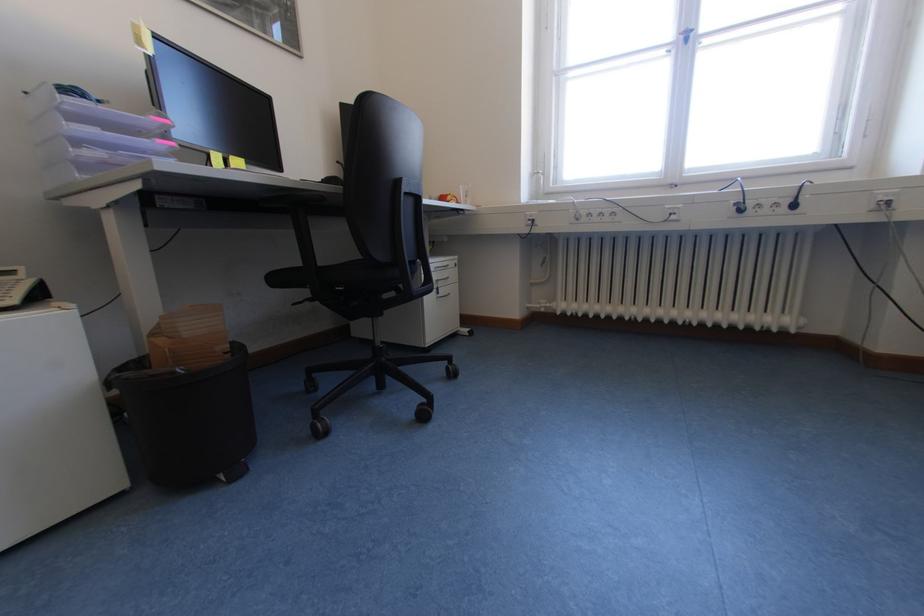
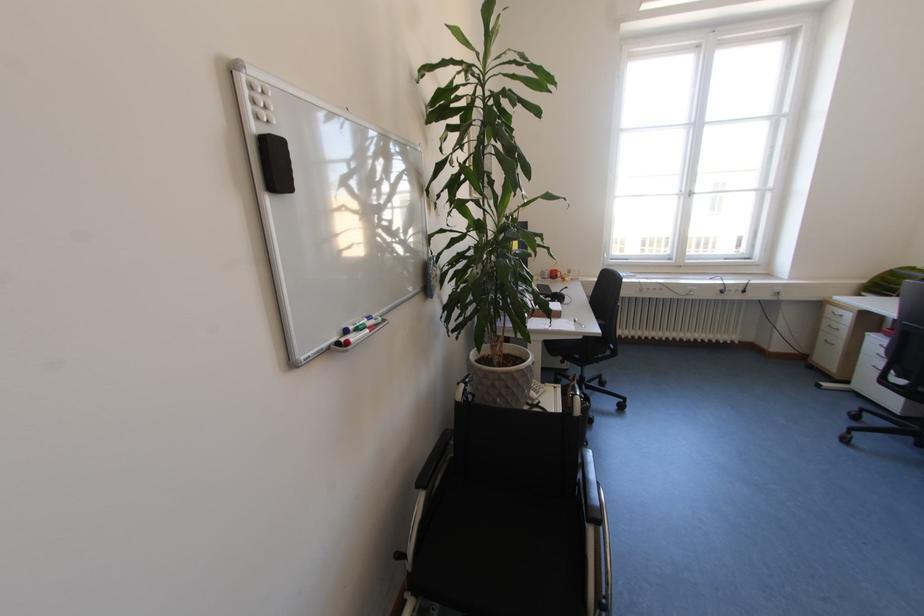
Where in the second image is the point corresponding to pixel 147 185 from the first image?

(589, 339)